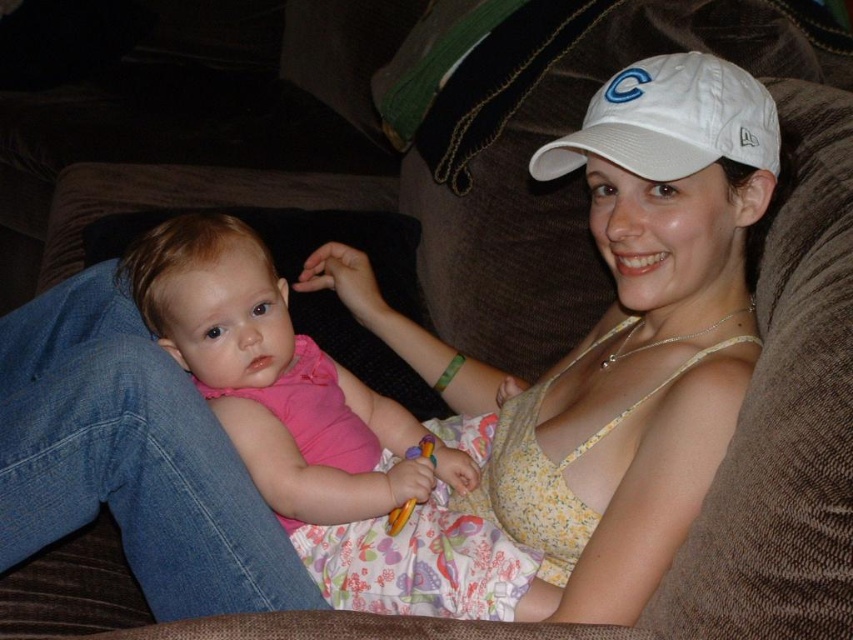
Is pink fabric baby at center bigger than white fabric cap at upper center?

Correct, pink fabric baby at center is larger in size than white fabric cap at upper center.

What do you see at coordinates (270, 372) in the screenshot? This screenshot has height=640, width=853. I see `pink fabric baby at center` at bounding box center [270, 372].

Find the location of a particular element. This screenshot has width=853, height=640. pink fabric baby at center is located at coordinates (270, 372).